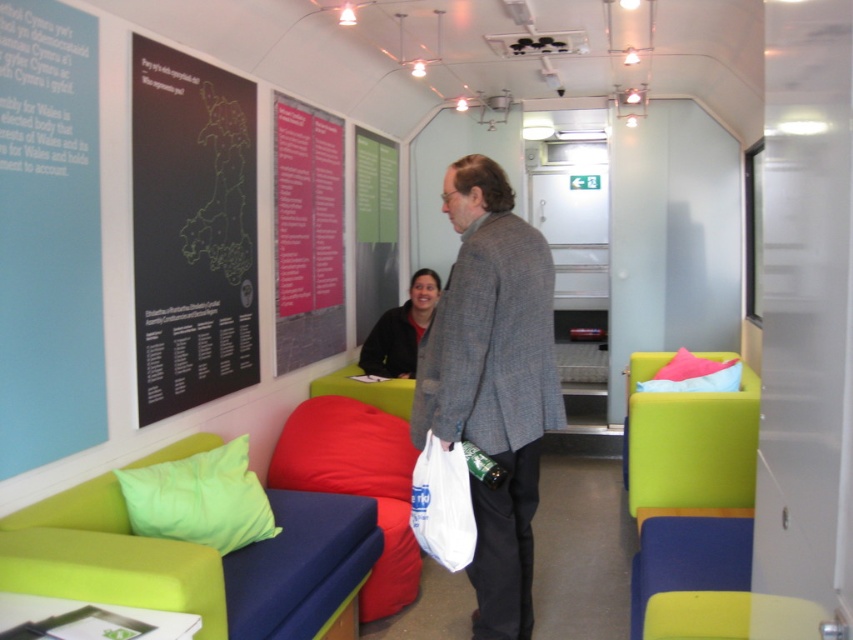
Is green fabric couch at lower left thinner than matte blue couch at lower right?

In fact, green fabric couch at lower left might be wider than matte blue couch at lower right.

Does point (299, 589) come in front of point (647, 536)?

Yes, point (299, 589) is in front of point (647, 536).

Where is `green fabric couch at lower left`? The width and height of the screenshot is (853, 640). green fabric couch at lower left is located at coordinates (177, 557).

This screenshot has width=853, height=640. Identify the location of green fabric couch at lower left. (177, 557).

Is matte black jacket at center bigger than pink fabric pillow at right?

No, matte black jacket at center is not bigger than pink fabric pillow at right.

Does point (415, 317) lie behind point (677, 392)?

Yes, point (415, 317) is behind point (677, 392).

This screenshot has width=853, height=640. I want to click on matte black jacket at center, so click(401, 330).

What do you see at coordinates (306, 234) in the screenshot?
I see `pink paper at upper center` at bounding box center [306, 234].

Find the location of `pink paper at upper center`. pink paper at upper center is located at coordinates (306, 234).